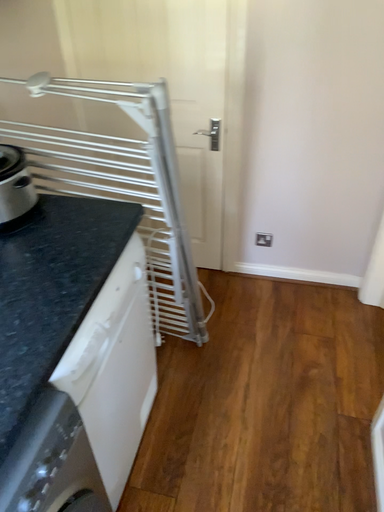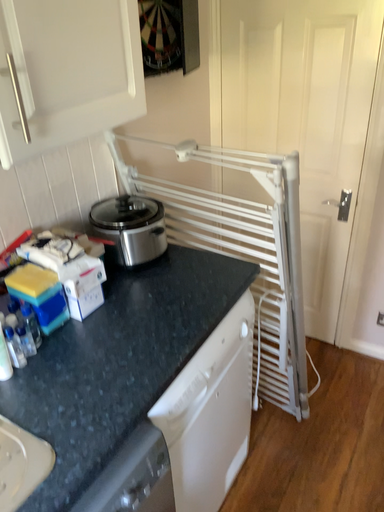
Question: How did the camera likely rotate when shooting the video?

Choices:
 (A) rotated upward
 (B) rotated downward

Answer: (A)